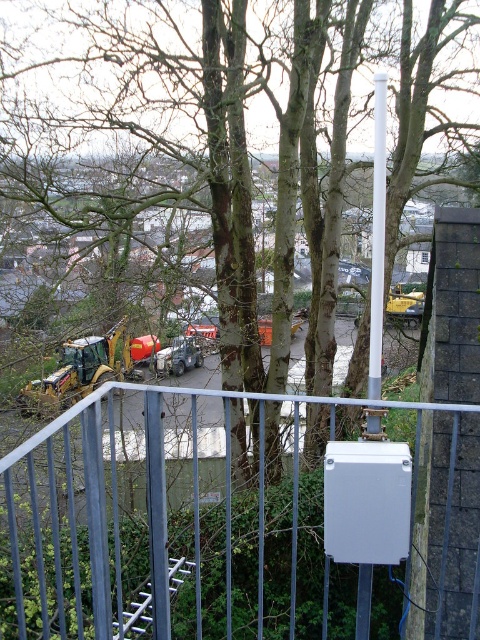
You are standing on a balcony overlooking a construction site. You notice two points marked in the scene. Which point, point 1 at coordinates (255,483) or point 2 at (90,362), is closer to you?

Point 1 at coordinates (255,483) is closer to the viewer than point 2 at (90,362).

You are standing on a balcony overlooking a construction site. You notice a point marked at coordinates (x=228, y=525). What object is located at that point?

The point at coordinates (x=228, y=525) indicates a metallic gray fence at center.